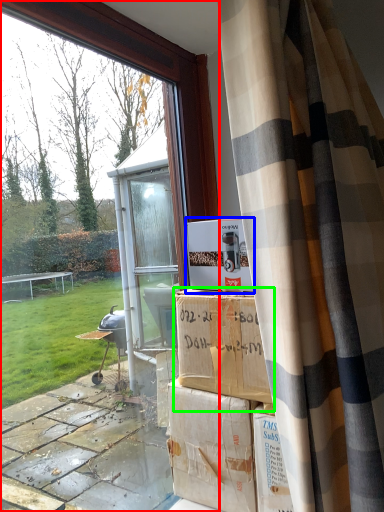
Question: Considering the real-world distances, which object is farthest from window (highlighted by a red box)? cardboard box (highlighted by a blue box) or cardboard box (highlighted by a green box)?

Choices:
 (A) cardboard box
 (B) cardboard box

Answer: (B)